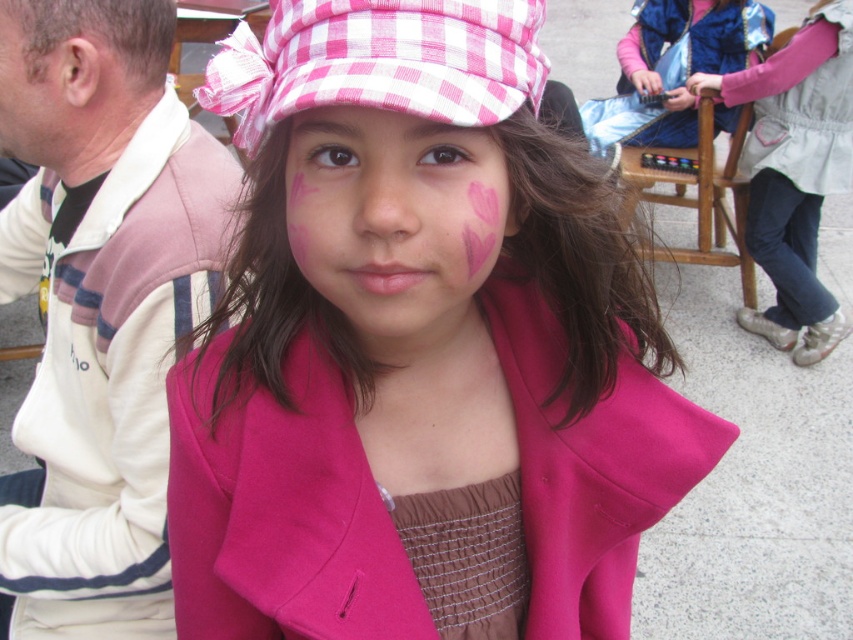
Question: Is the position of pink matte jacket at center more distant than that of pink checkered fabric hat at upper center?

Choices:
 (A) no
 (B) yes

Answer: (B)

Question: Which point is closer to the camera taking this photo?

Choices:
 (A) (54, 90)
 (B) (785, 97)
 (C) (187, 252)

Answer: (A)

Question: Which point is closer to the camera?

Choices:
 (A) (825, 106)
 (B) (177, 570)
 (C) (460, 13)
 (D) (355, 317)

Answer: (C)

Question: Which of the following is the farthest from the observer?

Choices:
 (A) pink fabric jacket at upper right
 (B) pink matte heart at center

Answer: (A)

Question: Does pink matte hat at upper center lie in front of brown mesh dress at center?

Choices:
 (A) no
 (B) yes

Answer: (B)

Question: In this image, where is pink matte heart at center located relative to dry skin at left?

Choices:
 (A) left
 (B) right

Answer: (B)